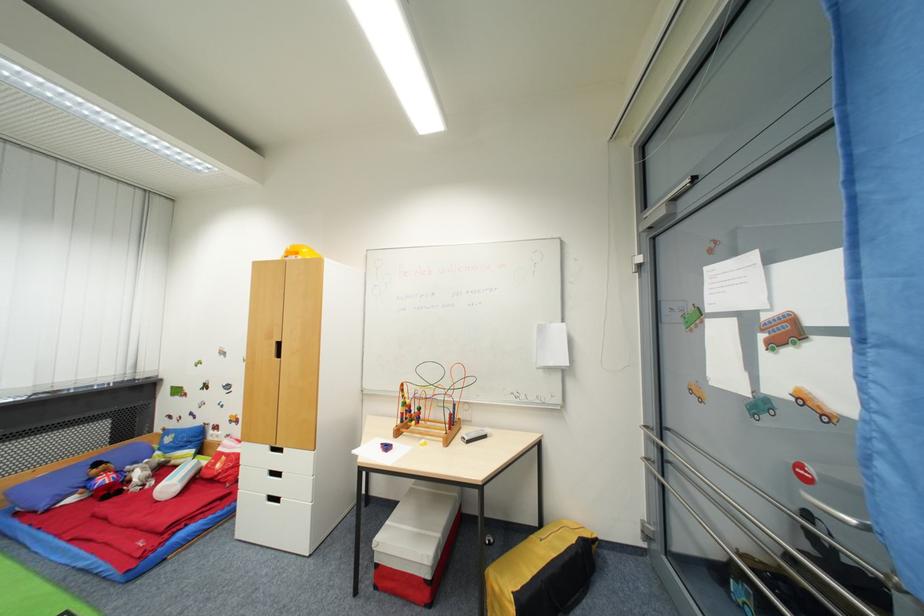
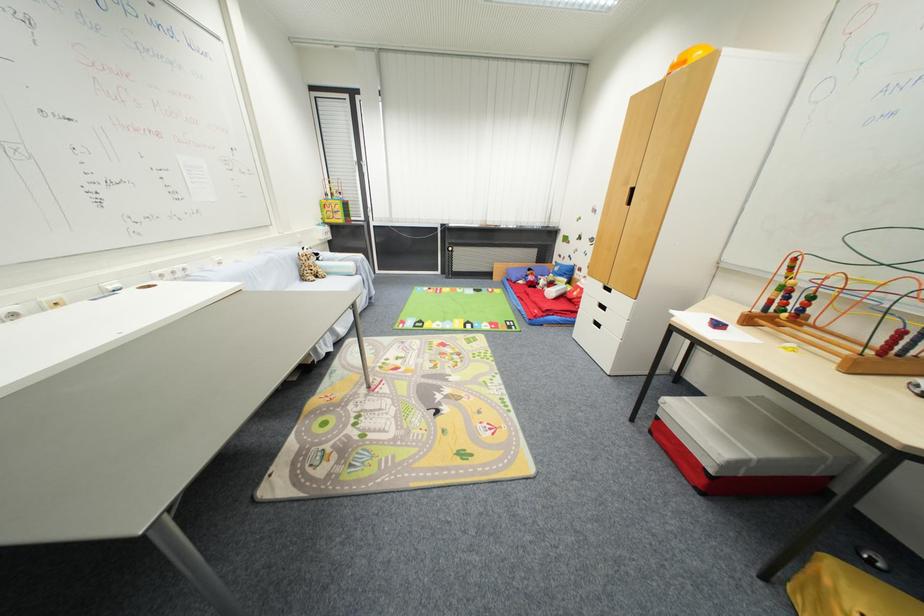
In the second image, find the point that corresponds to point (273, 448) in the first image.

(606, 286)